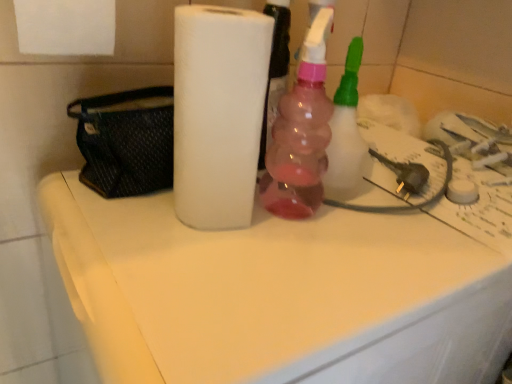
The height and width of the screenshot is (384, 512). In order to click on free location in front of black mesh pouch at left in this screenshot , I will do `click(139, 242)`.